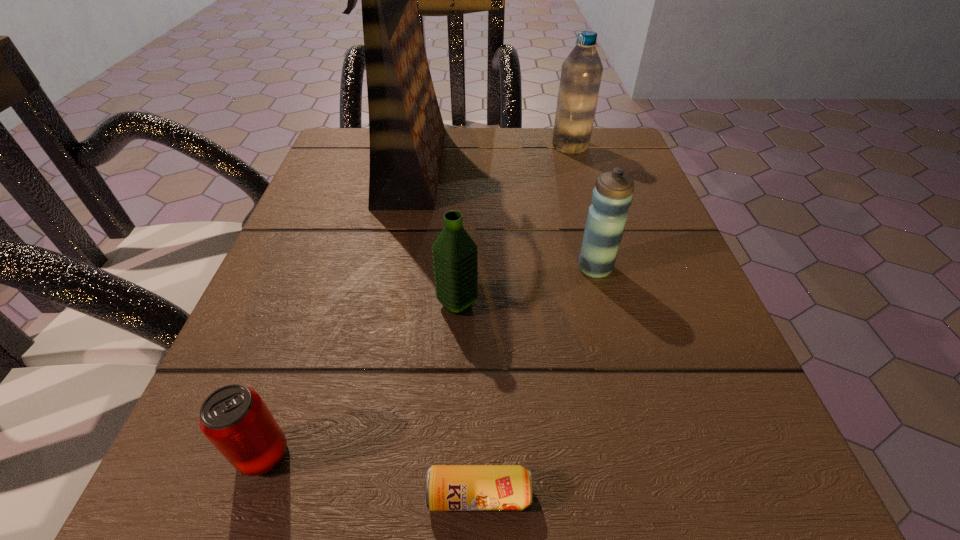
Locate an element on the screen. free space located on the left of the third farthest object is located at coordinates (509, 268).

Find the location of a particular element. vacant space located 0.170m on the back of the nearest water bottle is located at coordinates (462, 221).

Locate an element on the screen. The height and width of the screenshot is (540, 960). free space located 0.230m on the back of the can is located at coordinates (322, 288).

Image resolution: width=960 pixels, height=540 pixels. In order to click on vacant space located on the left of the shortest object in this screenshot , I will do `click(352, 495)`.

The image size is (960, 540). I want to click on shopping bag that is positioned at the far edge, so click(406, 130).

The height and width of the screenshot is (540, 960). I want to click on water bottle at the far edge, so 581,72.

Locate an element on the screen. The height and width of the screenshot is (540, 960). can that is positioned at the near edge is located at coordinates (235, 419).

Identify the location of beer can present at the near edge. (447, 487).

The image size is (960, 540). What are the coordinates of `shopping bag at the left edge` in the screenshot? It's located at (406, 130).

Locate an element on the screen. The width and height of the screenshot is (960, 540). can that is at the left edge is located at coordinates (235, 419).